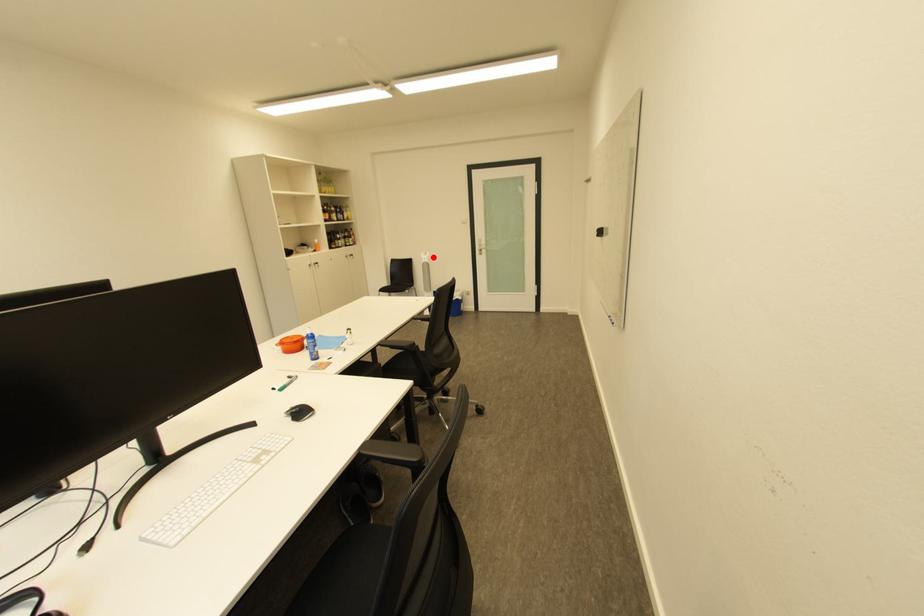
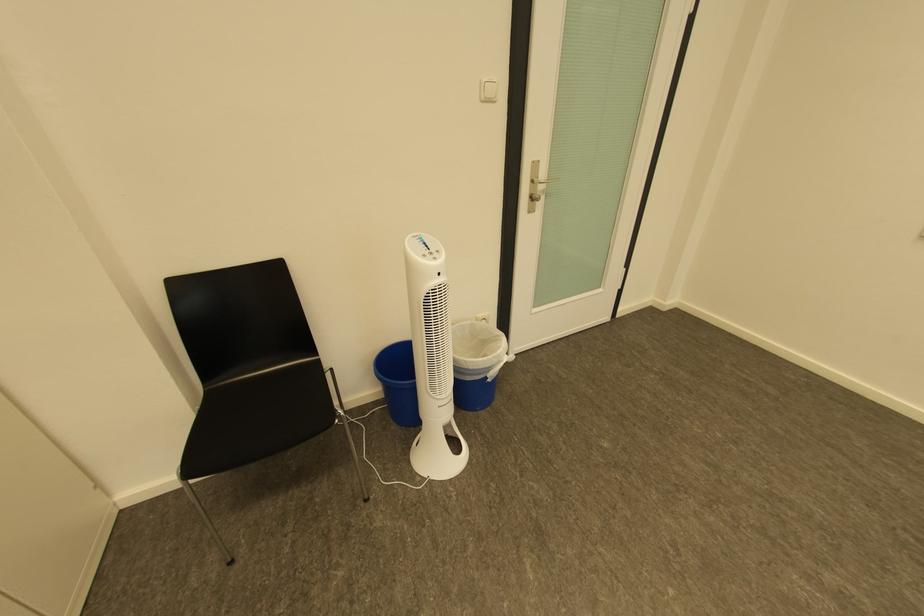
Locate, in the second image, the point that corresponds to the highlighted location in the first image.

(439, 262)